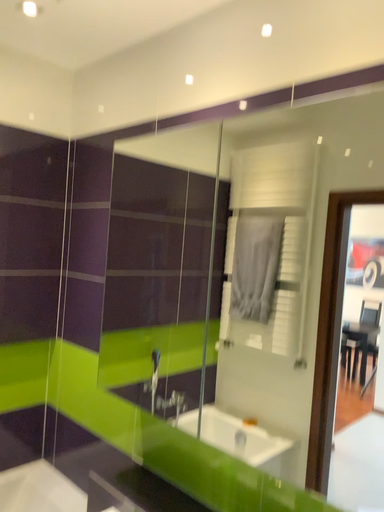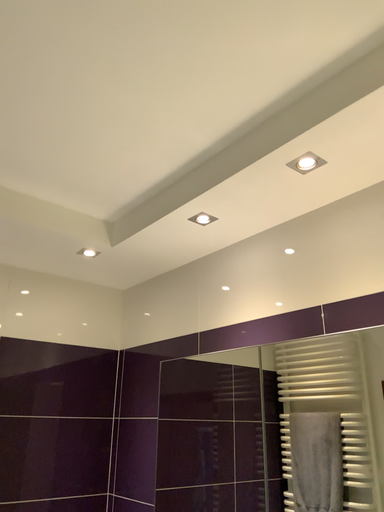
Question: How did the camera likely rotate when shooting the video?

Choices:
 (A) rotated left
 (B) rotated right

Answer: (A)